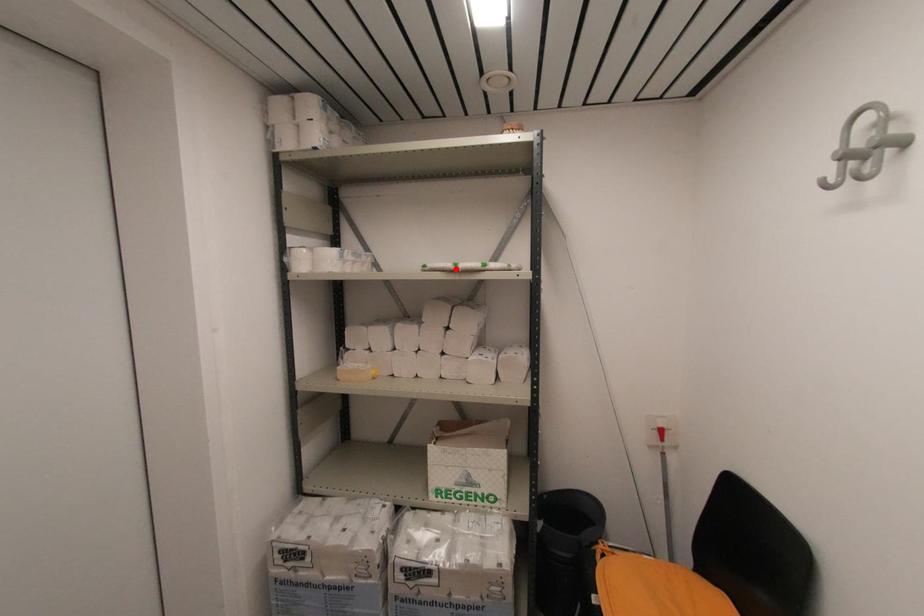
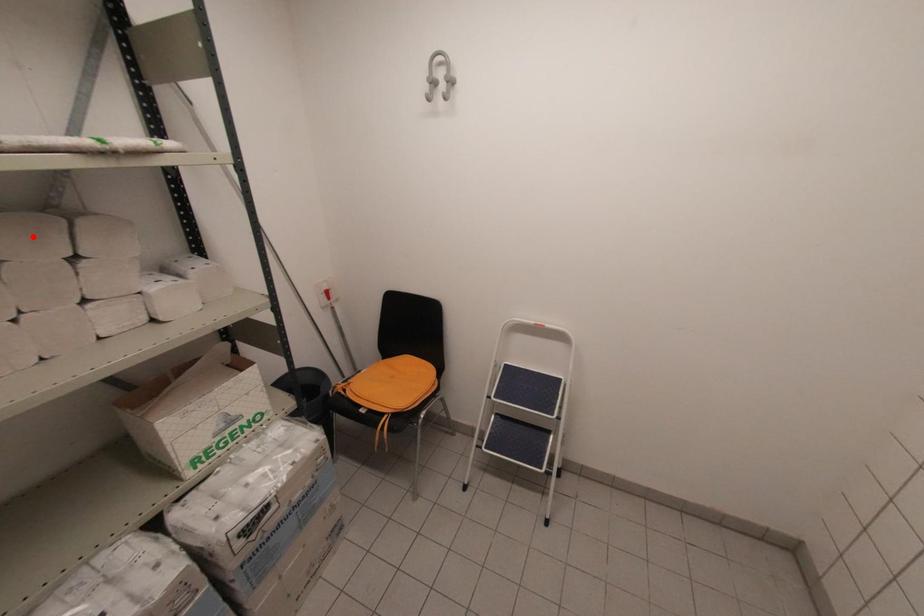
I am providing you with two images of the same scene from different viewpoints. A red point is marked on the first image and another point is marked on the second image. Does the point marked in image1 correspond to the same location as the one in image2?

No